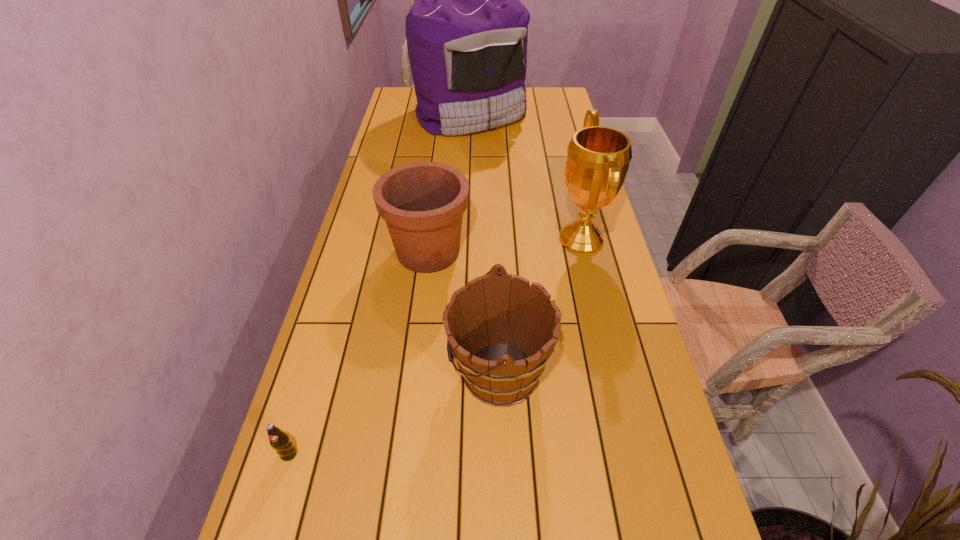
Find the location of a particular element. empty space that is in between the rightmost object and the pop is located at coordinates (435, 346).

The image size is (960, 540). What are the coordinates of `empty space between the flowerpot and the shortest object` in the screenshot? It's located at (359, 353).

What are the coordinates of `empty location between the wine bucket and the tallest object` in the screenshot? It's located at (485, 243).

Locate an element on the screen. vacant space that's between the flowerpot and the pop is located at coordinates (359, 353).

Find the location of `free area in between the farthest object and the rightmost object`. free area in between the farthest object and the rightmost object is located at coordinates (526, 177).

This screenshot has height=540, width=960. What are the coordinates of `the third closest object relative to the farthest object` in the screenshot? It's located at (479, 318).

The height and width of the screenshot is (540, 960). I want to click on object that is the third closest to the award, so click(x=467, y=33).

Image resolution: width=960 pixels, height=540 pixels. Find the location of `free space that satisfies the following two spatial constraints: 1. with the handle on the wine bucket; 2. on the front label of the nearest object`. free space that satisfies the following two spatial constraints: 1. with the handle on the wine bucket; 2. on the front label of the nearest object is located at coordinates (502, 454).

At what (x,y) coordinates should I click in order to perform the action: click on vacant area in the image that satisfies the following two spatial constraints: 1. with the handle on the fourth farthest object; 2. on the front label of the shortest object. Please return your answer as a coordinate pair (x, y). The width and height of the screenshot is (960, 540). Looking at the image, I should click on (502, 454).

This screenshot has height=540, width=960. I want to click on free spot that satisfies the following two spatial constraints: 1. on the front-facing side of the rightmost object; 2. on the front label of the pop, so click(x=633, y=454).